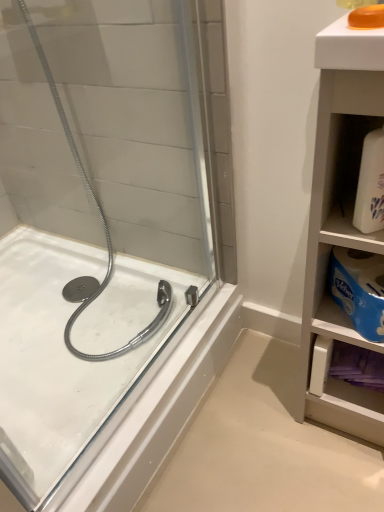
Question: Considering the relative positions of white matte bottle at right and translucent orange soap at upper right in the image provided, is white matte bottle at right to the left or to the right of translucent orange soap at upper right?

Choices:
 (A) left
 (B) right

Answer: (B)

Question: Is white matte bottle at right bigger or smaller than translucent orange soap at upper right?

Choices:
 (A) small
 (B) big

Answer: (B)

Question: Which of these objects is positioned farthest from the white matte bottle at right?

Choices:
 (A) translucent orange soap at upper right
 (B) white glossy bath at left
 (C) white matte cabinet at right

Answer: (B)

Question: Which object is the closest to the white matte cabinet at right?

Choices:
 (A) white matte bottle at right
 (B) white glossy bath at left
 (C) translucent orange soap at upper right

Answer: (A)